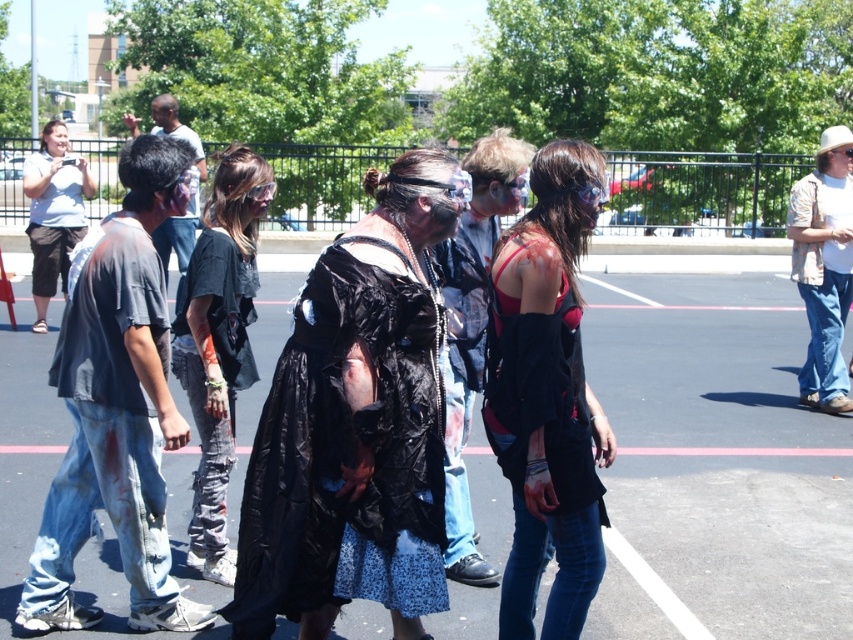
You are a costume designer observing the zombie group. You need to determine which piece of clothing is shorter between the ripped denim pants at center and the tan woven shirt at right. Can you identify which one is shorter?

The ripped denim pants at center is not as tall as tan woven shirt at right, so the ripped denim pants at center is shorter than the tan woven shirt at right.

You are a photographer trying to capture a clear photo of the tan woven shirt at right. However, the ripped denim pants at center are blocking your view. Can you move to the side to avoid the obstruction?

The ripped denim pants at center is in front of the tan woven shirt at right, so moving to the side might allow you to capture the tan woven shirt at right without the obstruction.

You are a photographer at the zombie event. You want to take a photo of the matte black jacket at center and the ripped denim pants at center. Which object should you focus on first if you are standing to the left of both objects?

You should focus on the ripped denim pants at center first because the matte black jacket at center is positioned to the right of the ripped denim pants at center, making the denim pants closer to your left side.